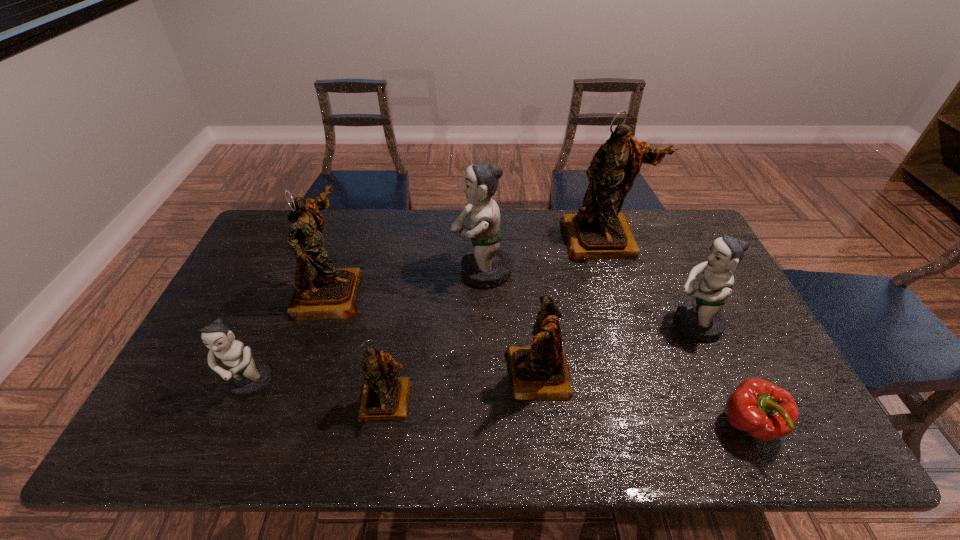
Find the location of a particular element. vacant area that lies between the tallest figurine and the leftmost green figurine is located at coordinates (426, 312).

Locate an element on the screen. The image size is (960, 540). free spot between the pepper and the third figurine from left to right is located at coordinates coord(568,413).

Where is `vacant area that lies between the tallest object and the smallest gold figurine`? The image size is (960, 540). vacant area that lies between the tallest object and the smallest gold figurine is located at coordinates (494, 320).

This screenshot has height=540, width=960. What are the coordinates of `free space between the smallest gold figurine and the smallest green figurine` in the screenshot? It's located at (319, 392).

Find the location of a particular element. This screenshot has height=540, width=960. empty location between the shortest object and the second biggest green figurine is located at coordinates (722, 375).

Where is `vacant point located between the third nearest gold figurine and the smallest green figurine`? vacant point located between the third nearest gold figurine and the smallest green figurine is located at coordinates (290, 338).

The height and width of the screenshot is (540, 960). In order to click on vacant area between the leftmost green figurine and the farthest green figurine in this screenshot , I will do `click(367, 327)`.

Identify which object is the third closest to the pink pepper. Please provide its 2D coordinates. Your answer should be formatted as a tuple, i.e. [(x, y)], where the tuple contains the x and y coordinates of a point satisfying the conditions above.

[(598, 231)]

Identify the location of object that stands as the sixth closest to the third nearest gold figurine. (701, 319).

Select which figurine appears as the fourth closest to the third biggest gold figurine. Please provide its 2D coordinates. Your answer should be formatted as a tuple, i.e. [(x, y)], where the tuple contains the x and y coordinates of a point satisfying the conditions above.

[(598, 231)]